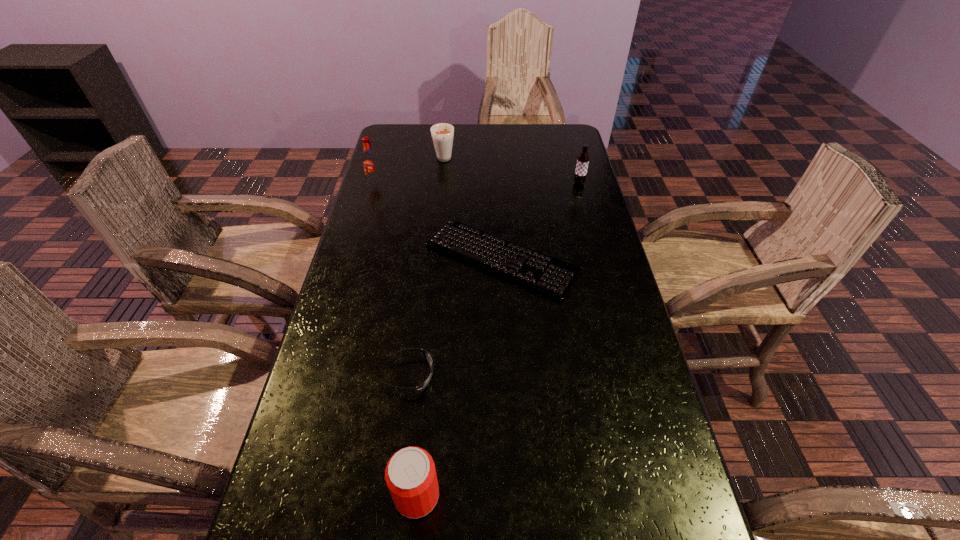
The image size is (960, 540). Identify the location of free space that is in between the leftmost root beer and the nearest object. (396, 340).

The width and height of the screenshot is (960, 540). Find the location of `vacant area that lies between the computer keyboard and the leftmost root beer`. vacant area that lies between the computer keyboard and the leftmost root beer is located at coordinates (438, 221).

Locate which object is the fourth closest to the beer can. Please provide its 2D coordinates. Your answer should be formatted as a tuple, i.e. [(x, y)], where the tuple contains the x and y coordinates of a point satisfying the conditions above.

[(583, 159)]

Identify which object is the closest to the rightmost object. Please provide its 2D coordinates. Your answer should be formatted as a tuple, i.e. [(x, y)], where the tuple contains the x and y coordinates of a point satisfying the conditions above.

[(554, 278)]

At what (x,y) coordinates should I click in order to perform the action: click on the closest root beer relative to the fifth tallest object. Please return your answer as a coordinate pair (x, y). This screenshot has height=540, width=960. Looking at the image, I should click on (370, 163).

Choose which root beer is the second nearest neighbor to the shortest object. Please provide its 2D coordinates. Your answer should be formatted as a tuple, i.e. [(x, y)], where the tuple contains the x and y coordinates of a point satisfying the conditions above.

[(370, 163)]

Where is `vacant space that satisfies the following two spatial constraints: 1. on the lenses of the second shortest object; 2. on the left side of the nearest object`? This screenshot has width=960, height=540. vacant space that satisfies the following two spatial constraints: 1. on the lenses of the second shortest object; 2. on the left side of the nearest object is located at coordinates (394, 495).

Image resolution: width=960 pixels, height=540 pixels. I want to click on vacant area in the image that satisfies the following two spatial constraints: 1. on the drink side of the shortest object; 2. on the left side of the farthest root beer, so click(x=434, y=258).

This screenshot has height=540, width=960. Identify the location of vacant space that satisfies the following two spatial constraints: 1. on the drink side of the fourth farthest object; 2. on the right side of the farthest object. (434, 258).

Identify the location of vacant area that satisfies the following two spatial constraints: 1. on the lenses of the fifth tallest object; 2. on the back side of the beer can. Image resolution: width=960 pixels, height=540 pixels. (394, 495).